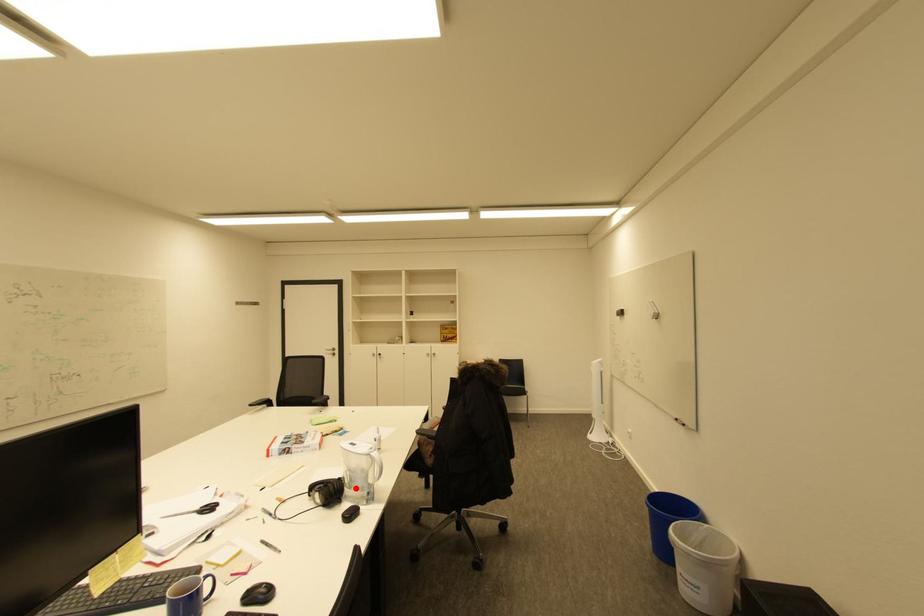
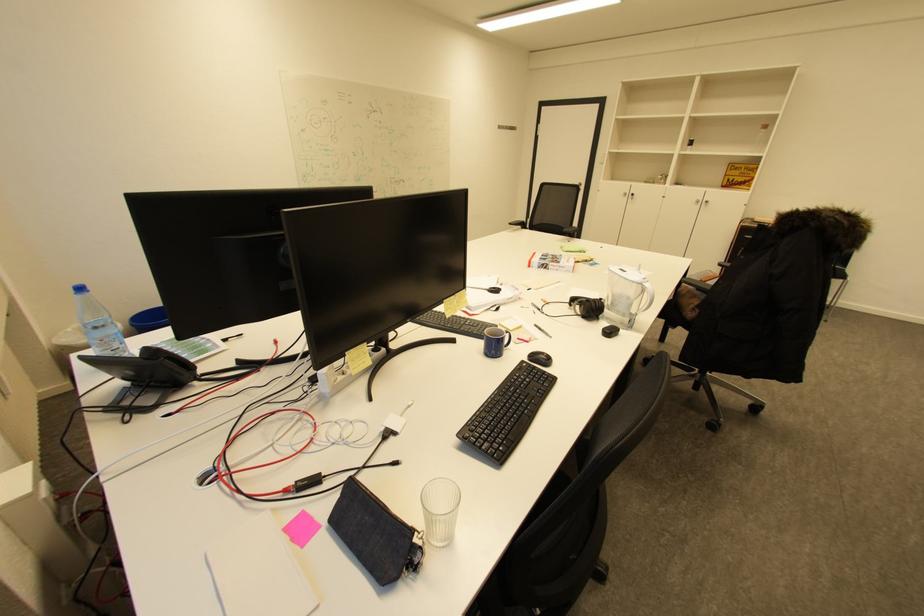
Question: I am providing you with two images of the same scene from different viewpoints. A red point is marked on the first image. Can you still see the location of the red point in image 2?

Choices:
 (A) Yes
 (B) No

Answer: (A)